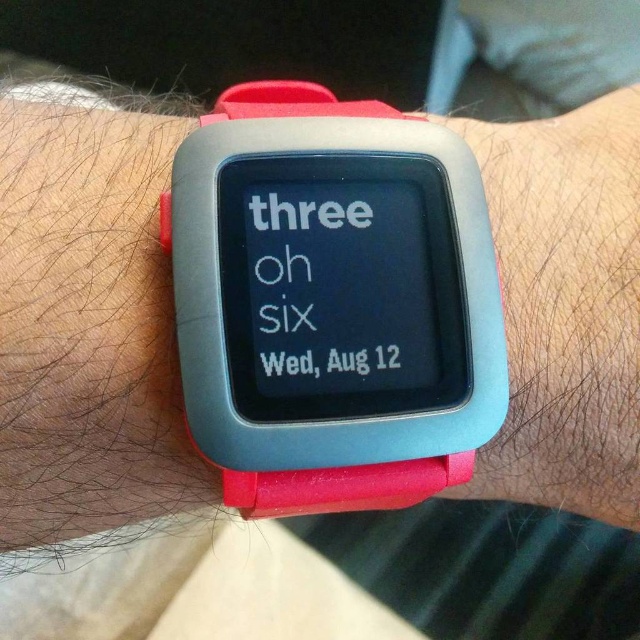
Question: Estimate the real-world distances between objects in this image. Which object is farther from the rubber watch at center?

Choices:
 (A) rubberized plastic watch at center
 (B) rubber band at center

Answer: (B)

Question: Is rubber watch at center bigger than rubber band at center?

Choices:
 (A) no
 (B) yes

Answer: (A)

Question: Which point is farther from the camera taking this photo?

Choices:
 (A) (593, 260)
 (B) (321, 500)
 (C) (44, 444)

Answer: (A)

Question: Which object is closer to the camera taking this photo?

Choices:
 (A) rubber watch at center
 (B) rubberized plastic watch at center
 (C) rubber band at center

Answer: (B)

Question: Can you confirm if rubber watch at center is positioned below rubber band at center?

Choices:
 (A) yes
 (B) no

Answer: (A)

Question: Is the position of rubber watch at center less distant than that of rubber band at center?

Choices:
 (A) yes
 (B) no

Answer: (A)